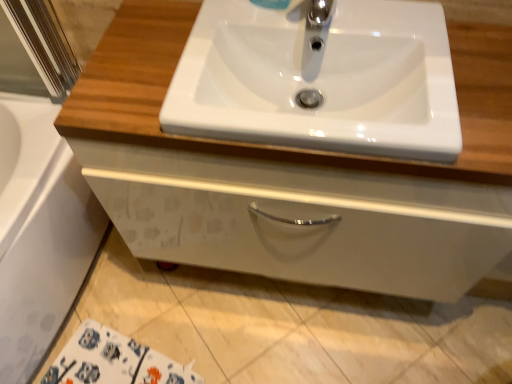
Locate an element on the screen. vacant space positioned to the left of chrome metallic faucet at upper center is located at coordinates (241, 34).